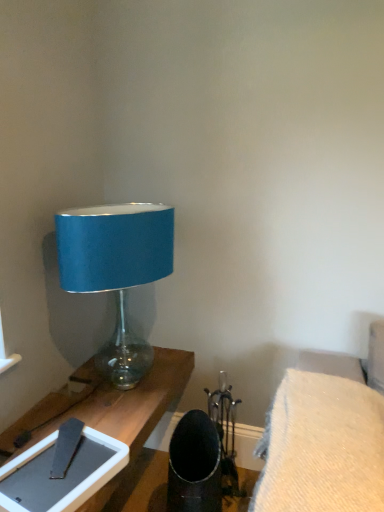
Question: Is blue fabric lampshade at left bigger or smaller than matte gray tablet at lower left?

Choices:
 (A) big
 (B) small

Answer: (A)

Question: Considering the positions of blue fabric lampshade at left and matte gray tablet at lower left in the image, is blue fabric lampshade at left taller or shorter than matte gray tablet at lower left?

Choices:
 (A) tall
 (B) short

Answer: (A)

Question: Which object is the closest to the blue fabric lampshade at left?

Choices:
 (A) matte gray tablet at lower left
 (B) woolen fabric cushion at lower right

Answer: (A)

Question: Which of these objects is positioned farthest from the matte gray tablet at lower left?

Choices:
 (A) woolen fabric cushion at lower right
 (B) blue fabric lampshade at left

Answer: (B)